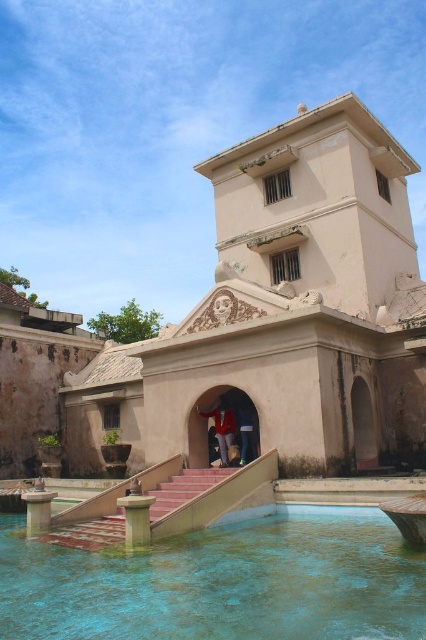
You are standing in front of the historical structure and want to find the blue glossy water at bottom. According to the coordinates provided, where should you look relative to the building?

The blue glossy water at bottom is located at coordinates point (221, 582), which is to the lower right side of the building.

You are standing in front of the historical building and notice the blue glossy water at bottom and the dark blue jeans at center. Which object is positioned higher up in the scene?

The dark blue jeans at center is positioned higher up because the blue glossy water at bottom is taller than it, meaning the water is placed lower down in the scene.